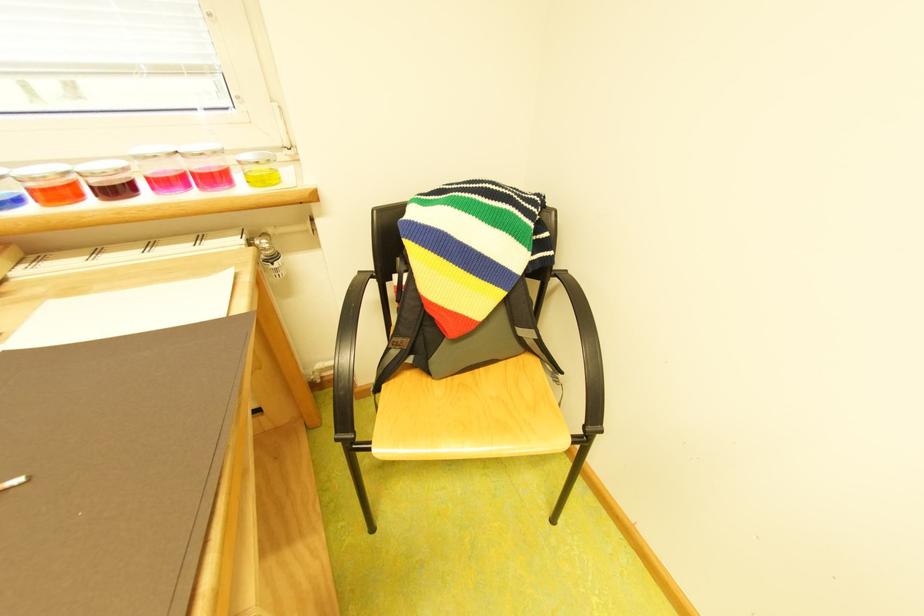
This screenshot has height=616, width=924. In order to click on chair sitting surface in this screenshot , I will do `click(468, 423)`.